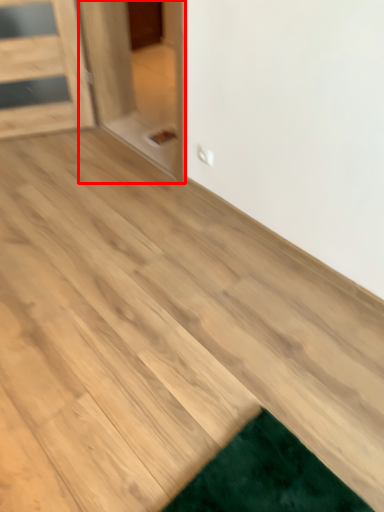
Question: From the image's perspective, what is the correct spatial positioning of glass door (annotated by the red box) in reference to plywood?

Choices:
 (A) below
 (B) above

Answer: (B)